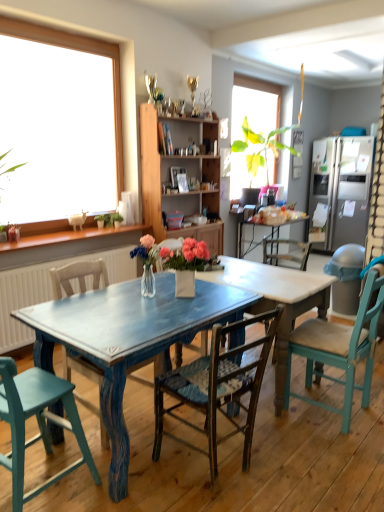
Question: From a real-world perspective, is distressed blue table at center on top of wooden woven seat chair at center, the third chair viewed from the left?

Choices:
 (A) no
 (B) yes

Answer: (A)

Question: Would you say distressed blue table at center contains wooden woven seat chair at center, the second chair viewed from the right?

Choices:
 (A) no
 (B) yes

Answer: (A)

Question: Is distressed blue table at center outside of wooden woven seat chair at center, the third chair viewed from the left?

Choices:
 (A) no
 (B) yes

Answer: (B)

Question: Does distressed blue table at center have a larger size compared to wooden woven seat chair at center, the third chair viewed from the left?

Choices:
 (A) yes
 (B) no

Answer: (A)

Question: Does distressed blue table at center appear on the right side of wooden woven seat chair at center, the third chair viewed from the left?

Choices:
 (A) yes
 (B) no

Answer: (A)

Question: In terms of width, does wooden chair at left, the second chair when ordered from left to right, look wider or thinner when compared to wooden cabinet at center?

Choices:
 (A) thin
 (B) wide

Answer: (B)

Question: Is wooden chair at left, the second chair when ordered from left to right, bigger or smaller than wooden cabinet at center?

Choices:
 (A) big
 (B) small

Answer: (B)

Question: Relative to wooden cabinet at center, is wooden chair at left, the second chair when ordered from left to right, in front or behind?

Choices:
 (A) front
 (B) behind

Answer: (A)

Question: Considering the positions of wooden chair at left, the 3th chair viewed from the right, and wooden cabinet at center in the image, is wooden chair at left, the 3th chair viewed from the right, taller or shorter than wooden cabinet at center?

Choices:
 (A) tall
 (B) short

Answer: (B)

Question: In the image, is distressed blue table at center on the left side or the right side of blue distressed wood table at center?

Choices:
 (A) left
 (B) right

Answer: (A)

Question: Is distressed blue table at center wider or thinner than blue distressed wood table at center?

Choices:
 (A) thin
 (B) wide

Answer: (A)

Question: From the image's perspective, is distressed blue table at center located above or below blue distressed wood table at center?

Choices:
 (A) below
 (B) above

Answer: (B)

Question: Is point (233, 280) closer or farther from the camera than point (218, 279)?

Choices:
 (A) closer
 (B) farther

Answer: (A)

Question: Considering the positions of wooden cabinet at center and teal painted wood chair at lower left, which appears as the 4th chair when viewed from the right, in the image, is wooden cabinet at center taller or shorter than teal painted wood chair at lower left, which appears as the 4th chair when viewed from the right,?

Choices:
 (A) short
 (B) tall

Answer: (B)

Question: Is wooden cabinet at center inside or outside of teal painted wood chair at lower left, which appears as the 4th chair when viewed from the right?

Choices:
 (A) outside
 (B) inside

Answer: (A)